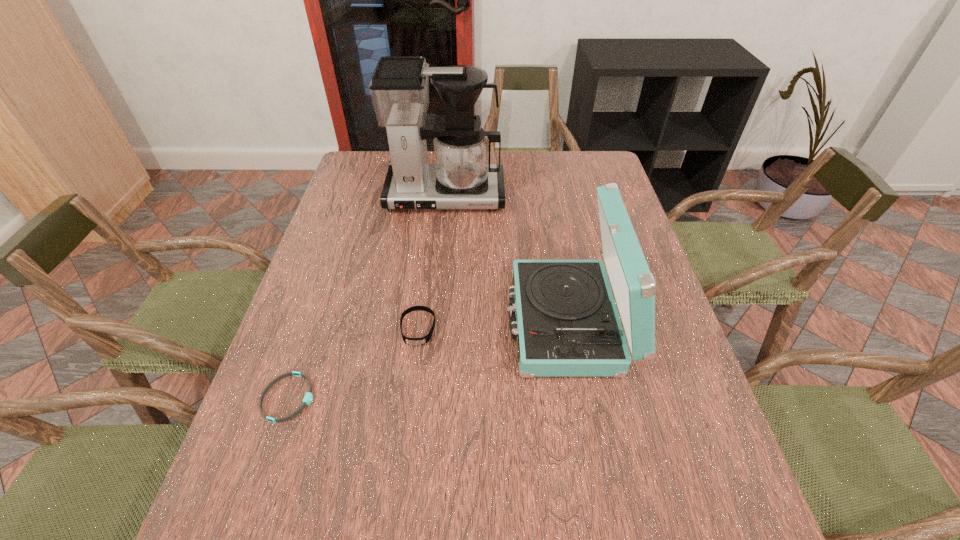
The image size is (960, 540). What are the coordinates of `vacant space located 0.400m on the face side of the record player` in the screenshot? It's located at (342, 322).

Locate an element on the screen. The width and height of the screenshot is (960, 540). free spot located on the display of the farther wristband is located at coordinates (x=396, y=498).

Locate an element on the screen. Image resolution: width=960 pixels, height=540 pixels. vacant area situated on the buckle of the shorter wristband is located at coordinates (367, 398).

Where is `object at the far edge`? object at the far edge is located at coordinates (462, 177).

Locate an element on the screen. Image resolution: width=960 pixels, height=540 pixels. coffee maker located at the left edge is located at coordinates (462, 177).

Identify the location of wristband located at the left edge. The image size is (960, 540). (308, 397).

What are the coordinates of `object present at the right edge` in the screenshot? It's located at (565, 318).

Find the location of a particular element. This screenshot has width=960, height=540. object located at the far left corner is located at coordinates (462, 177).

Find the location of `free region at the far edge of the desktop`. free region at the far edge of the desktop is located at coordinates (549, 160).

Find the location of `vacant space at the left edge of the desktop`. vacant space at the left edge of the desktop is located at coordinates pos(357,302).